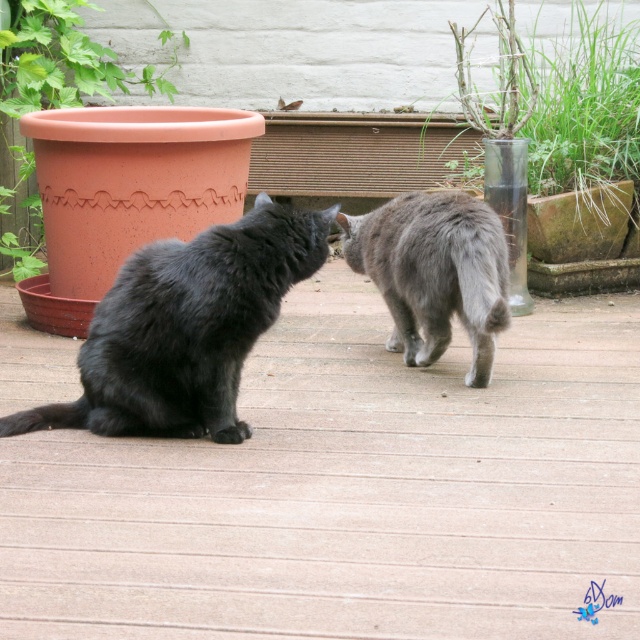
Question: Which object is positioned closest to the smooth wooden deck at center?

Choices:
 (A) gray fluffy cat at center
 (B) transparent glass vase at upper center
 (C) shiny black cat at left

Answer: (A)

Question: In this image, where is smooth wooden deck at center located relative to gray fluffy cat at center?

Choices:
 (A) left
 (B) right

Answer: (A)

Question: Among these objects, which one is farthest from the camera?

Choices:
 (A) transparent glass vase at upper center
 (B) terracotta clay pot at left
 (C) gray fluffy cat at center
 (D) smooth wooden deck at center

Answer: (B)

Question: Does transparent glass vase at upper center lie behind gray fluffy cat at center?

Choices:
 (A) yes
 (B) no

Answer: (A)

Question: Can you confirm if smooth wooden deck at center is wider than transparent glass vase at upper center?

Choices:
 (A) yes
 (B) no

Answer: (A)

Question: Which point appears closest to the camera in this image?

Choices:
 (A) (179, 269)
 (B) (84, 572)
 (C) (77, 60)

Answer: (B)